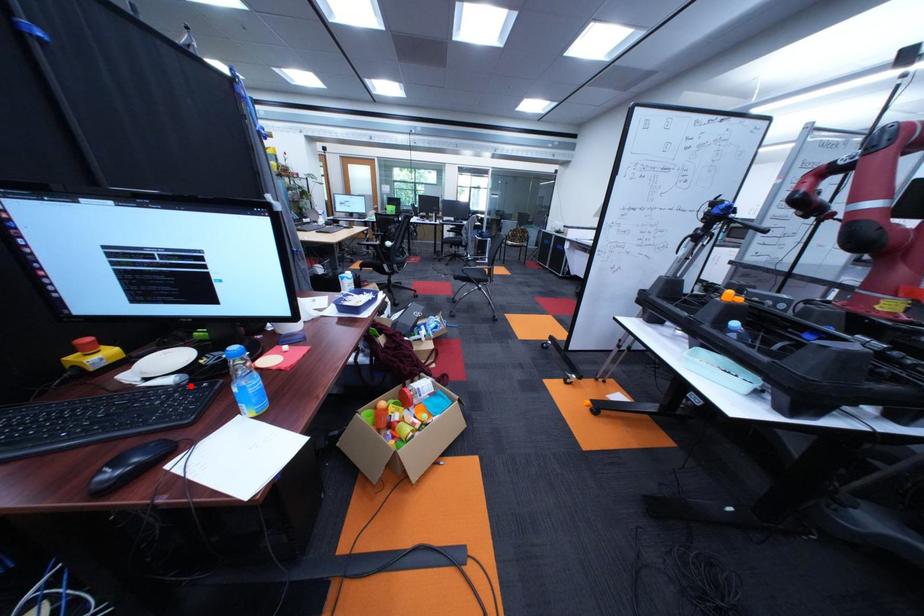
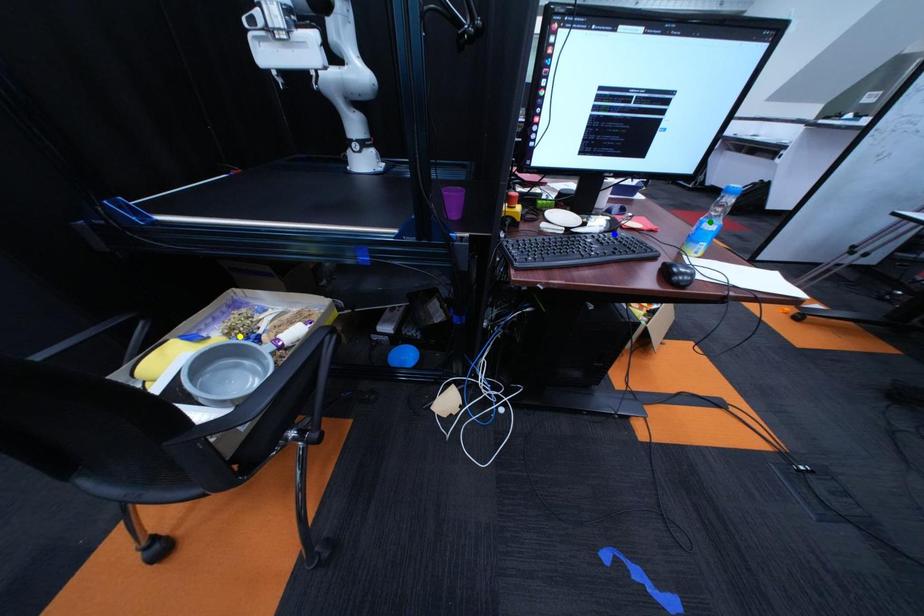
Question: I am providing you with two images of the same scene from different viewpoints. A red point is marked on the first image. You are given multiple points on the second image. Which spot in image 2 lines up with the point in image 1?

Choices:
 (A) green point
 (B) yellow point
 (C) blue point

Answer: (C)